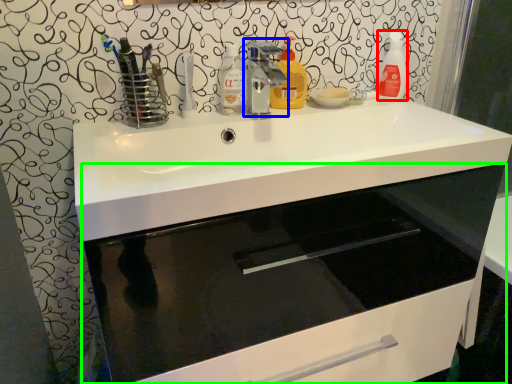
Question: Which object is positioned closest to cleaning product (highlighted by a red box)? Select from tap (highlighted by a blue box) and bathroom cabinet (highlighted by a green box).

Choices:
 (A) tap
 (B) bathroom cabinet

Answer: (A)